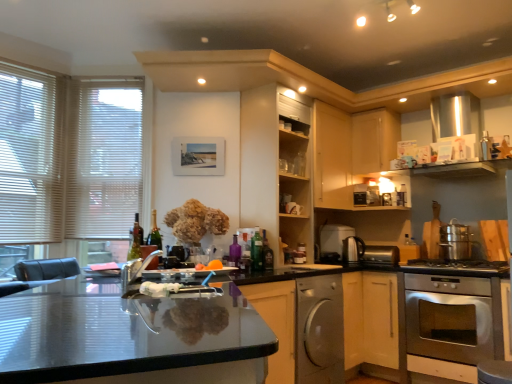
Question: Could you tell me if metallic silver toaster at lower center, which is counted as the 1th appliance, starting from the right, is facing satin silver dishwasher at lower center?

Choices:
 (A) yes
 (B) no

Answer: (B)

Question: Can you confirm if metallic silver toaster at lower center, which is counted as the 1th appliance, starting from the right, is shorter than satin silver dishwasher at lower center?

Choices:
 (A) yes
 (B) no

Answer: (A)

Question: Is metallic silver toaster at lower center, the third appliance in the front-to-back sequence, not close to satin silver dishwasher at lower center?

Choices:
 (A) no
 (B) yes

Answer: (A)

Question: Are metallic silver toaster at lower center, placed as the 2th appliance when sorted from back to front, and satin silver dishwasher at lower center making contact?

Choices:
 (A) no
 (B) yes

Answer: (A)

Question: Considering the relative positions of metallic silver toaster at lower center, placed as the 2th appliance when sorted from back to front, and satin silver dishwasher at lower center in the image provided, is metallic silver toaster at lower center, placed as the 2th appliance when sorted from back to front, to the left of satin silver dishwasher at lower center from the viewer's perspective?

Choices:
 (A) no
 (B) yes

Answer: (A)

Question: From the image's perspective, is translucent glass bottle at center, which is the 1th bottle from left to right, located above or below wooden shelves at center, the 3th cabinetry from the right?

Choices:
 (A) below
 (B) above

Answer: (A)

Question: In terms of size, does translucent glass bottle at center, which is the 1th bottle from left to right, appear bigger or smaller than wooden shelves at center, marked as the first cabinetry in a left-to-right arrangement?

Choices:
 (A) big
 (B) small

Answer: (B)

Question: From a real-world perspective, relative to wooden shelves at center, marked as the first cabinetry in a left-to-right arrangement, is translucent glass bottle at center, which is the 1th bottle from left to right, vertically above or below?

Choices:
 (A) below
 (B) above

Answer: (A)

Question: Considering the relative positions of translucent glass bottle at center, which is the 1th bottle from left to right, and wooden shelves at center, marked as the first cabinetry in a left-to-right arrangement, in the image provided, is translucent glass bottle at center, which is the 1th bottle from left to right, to the left or to the right of wooden shelves at center, marked as the first cabinetry in a left-to-right arrangement,?

Choices:
 (A) right
 (B) left

Answer: (B)

Question: Considering the relative positions of stainless steel oven at lower right and white plastic blinds at left in the image provided, is stainless steel oven at lower right to the left or to the right of white plastic blinds at left?

Choices:
 (A) right
 (B) left

Answer: (A)

Question: Considering the positions of stainless steel oven at lower right and white plastic blinds at left in the image, is stainless steel oven at lower right taller or shorter than white plastic blinds at left?

Choices:
 (A) tall
 (B) short

Answer: (B)

Question: From a real-world perspective, is stainless steel oven at lower right above or below white plastic blinds at left?

Choices:
 (A) above
 (B) below

Answer: (B)

Question: Is stainless steel oven at lower right inside the boundaries of white plastic blinds at left, or outside?

Choices:
 (A) inside
 (B) outside

Answer: (B)

Question: In the image, is stainless steel oven at lower right positioned in front of or behind brushed metal faucet at center, which appears as the 4th appliance when viewed from the right?

Choices:
 (A) behind
 (B) front

Answer: (A)

Question: Is point (448, 284) positioned closer to the camera than point (142, 261)?

Choices:
 (A) closer
 (B) farther

Answer: (B)